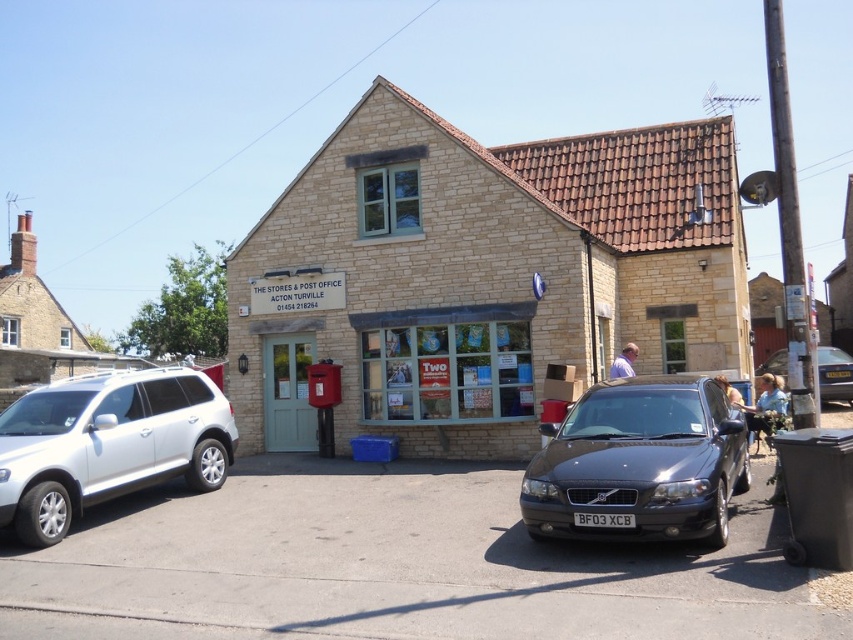
You are standing in front of the beige stone building at center and want to cross the road to reach the park on the other side. The road has a speed limit of 30 mph. Can you safely cross the road within the time it takes for a car traveling at the speed limit to pass by?

The distance between the beige stone building at center and the park is 40.80 feet. A car traveling at 30 mph would take approximately 0.4 seconds to cover this distance. Since the time is very short, it is not safe to cross the road in this time frame.

You are standing in front of the building and want to take a photo. There are two points marked on the ground where you can stand to capture the best shot. The first point is at coordinates point (634, 451), and the second is at point (183, 369). Which point should you choose to be closer to the camera for a better closeup of the building?

You should choose point (634, 451) because it is closer to the camera than point (183, 369), allowing for a better closeup of the building.